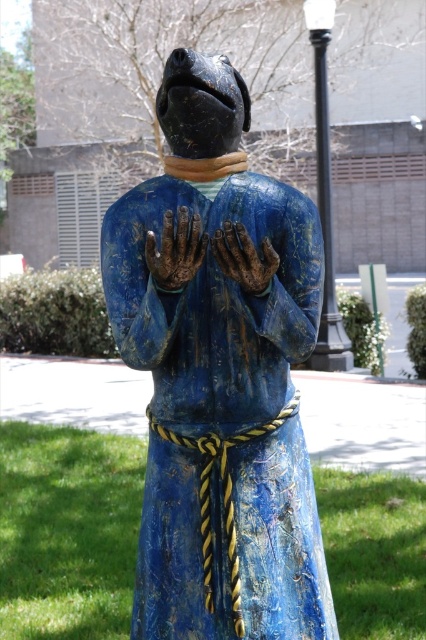
Question: Which point appears farthest from the camera in this image?

Choices:
 (A) (270, 253)
 (B) (195, 243)

Answer: (A)

Question: Can you confirm if brown textured hand at center is positioned above brown matte hand at center?

Choices:
 (A) no
 (B) yes

Answer: (B)

Question: Which object appears farthest from the camera in this image?

Choices:
 (A) blue painted wood statue at center
 (B) brown textured hand at center

Answer: (A)

Question: Which of the following is the farthest from the observer?

Choices:
 (A) brown textured hand at center
 (B) blue painted wood statue at center
 (C) brown matte hand at center

Answer: (B)

Question: From the image, what is the correct spatial relationship of blue painted wood statue at center in relation to brown matte hand at center?

Choices:
 (A) right
 (B) left

Answer: (B)

Question: Can you confirm if blue painted wood statue at center is wider than brown textured hand at center?

Choices:
 (A) yes
 (B) no

Answer: (A)